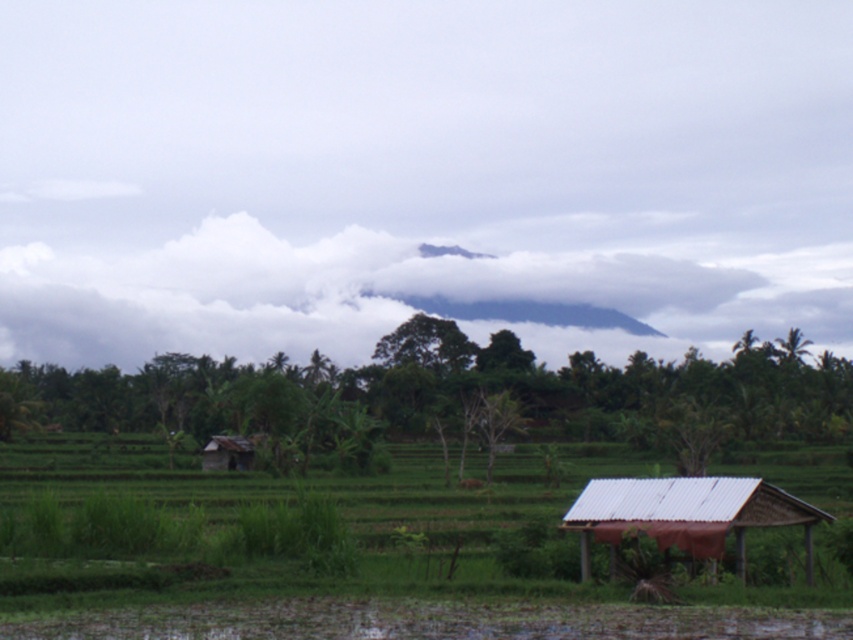
Between point (827, 250) and point (242, 436), which one is positioned behind?

The point (827, 250) is behind.

Is white fluffy cloud at upper center bigger than brown corrugated roof hut at lower left?

Yes, white fluffy cloud at upper center is bigger than brown corrugated roof hut at lower left.

Measure the distance between point (398, 282) and camera.

Point (398, 282) is 283.75 meters away from camera.

Identify the location of white fluffy cloud at upper center. This screenshot has height=640, width=853. (393, 296).

Which is behind, point (550, 310) or point (764, 499)?

The point (550, 310) is more distant.

Does white fluffy cloud at upper center appear over metal/thatched hut at lower right?

Correct, white fluffy cloud at upper center is located above metal/thatched hut at lower right.

Consider the image. Who is more forward, (42, 307) or (752, 497)?

Point (752, 497)

At what (x,y) coordinates should I click in order to perform the action: click on white fluffy cloud at upper center. Please return your answer as a coordinate pair (x, y). Looking at the image, I should click on (393, 296).

The width and height of the screenshot is (853, 640). What are the coordinates of `metal/thatched hut at lower right` in the screenshot? It's located at (688, 515).

Does metal/thatched hut at lower right have a lesser width compared to brown corrugated roof hut at lower left?

In fact, metal/thatched hut at lower right might be wider than brown corrugated roof hut at lower left.

Locate an element on the screen. The height and width of the screenshot is (640, 853). metal/thatched hut at lower right is located at coordinates (688, 515).